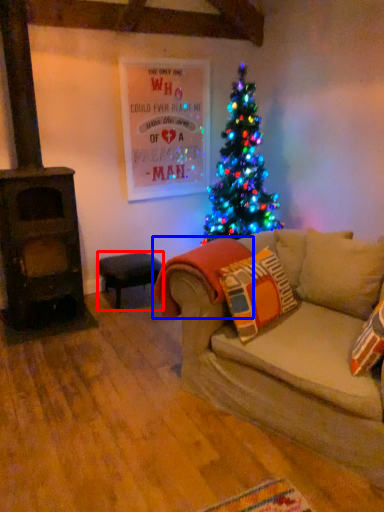
Question: Which object appears farthest to the camera in this image, stool (highlighted by a red box) or blanket (highlighted by a blue box)?

Choices:
 (A) stool
 (B) blanket

Answer: (A)